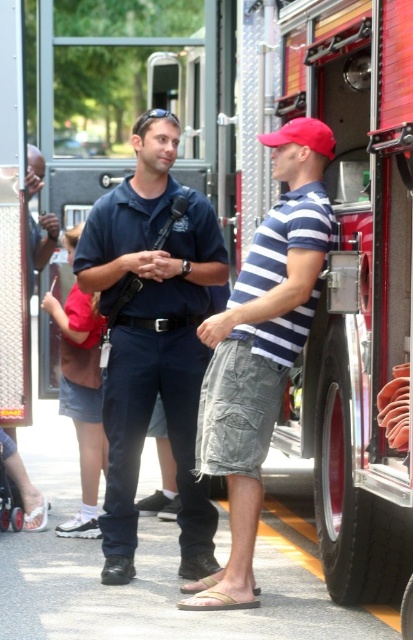
Who is higher up, dark blue uniform at center or red matte baseball cap at center?

Result: red matte baseball cap at center is above.

Can you confirm if dark blue uniform at center is shorter than red matte baseball cap at center?

In fact, dark blue uniform at center may be taller than red matte baseball cap at center.

Image resolution: width=413 pixels, height=640 pixels. I want to click on dark blue uniform at center, so click(152, 339).

Can you confirm if dark blue uniform at center is taller than striped cotton shirt at center?

Yes, dark blue uniform at center is taller than striped cotton shirt at center.

Which is more to the right, dark blue uniform at center or striped cotton shirt at center?

striped cotton shirt at center is more to the right.

Is point (121, 243) farther from camera compared to point (294, 305)?

Yes, it is.

Where is `dark blue uniform at center`? The width and height of the screenshot is (413, 640). dark blue uniform at center is located at coordinates (152, 339).

Does point (228, 577) come in front of point (313, 141)?

Yes, it is.

Where is `striped cotton shirt at center`? striped cotton shirt at center is located at coordinates (258, 360).